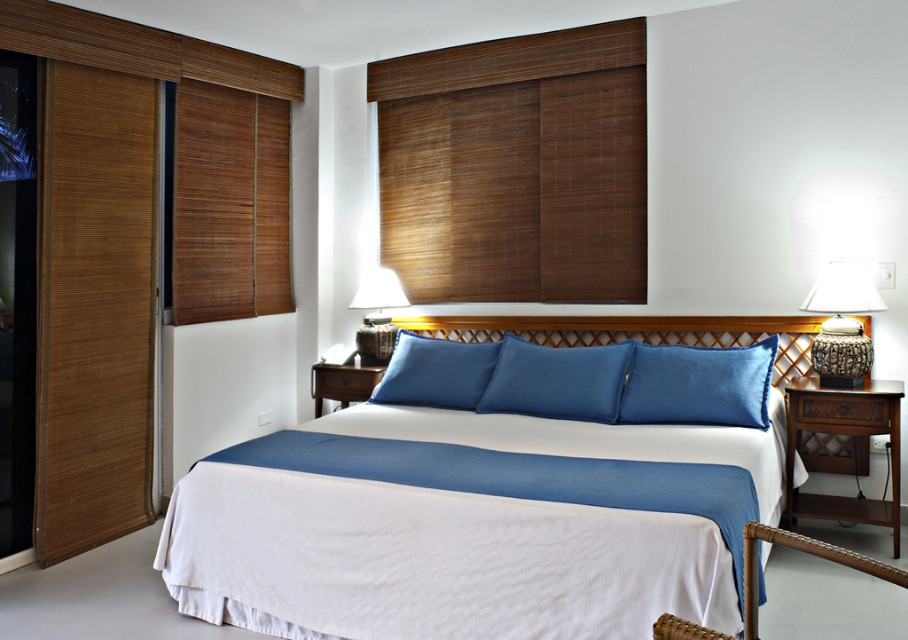
You are an interior designer planning to hang a new artwork between the brown woven blinds at upper center and the rattan textured lamp at right. Which object should the artwork be placed closer to if you want it centered between them?

The artwork should be placed closer to the rattan textured lamp at right because the brown woven blinds at upper center might be wider than the rattan textured lamp at right, requiring more space to maintain balance.